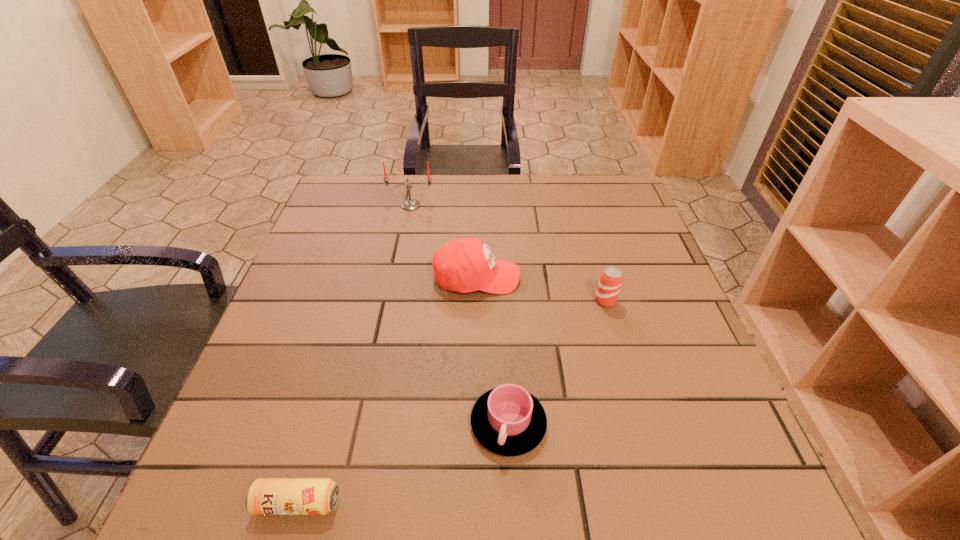
Where is `free space between the baseball cap and the third shortest object`? The width and height of the screenshot is (960, 540). free space between the baseball cap and the third shortest object is located at coordinates (541, 289).

What are the coordinates of `blank region between the baseball cap and the left beer can` in the screenshot? It's located at (387, 390).

Locate an element on the screen. free space between the second shortest object and the candle is located at coordinates (460, 314).

In order to click on empty space that is in between the fourth farthest object and the shorter beer can in this screenshot , I will do `click(403, 463)`.

Choose which object is the third nearest neighbor to the baseball cap. Please provide its 2D coordinates. Your answer should be formatted as a tuple, i.e. [(x, y)], where the tuple contains the x and y coordinates of a point satisfying the conditions above.

[(508, 420)]

Identify which object is located as the third nearest to the farthest object. Please provide its 2D coordinates. Your answer should be formatted as a tuple, i.e. [(x, y)], where the tuple contains the x and y coordinates of a point satisfying the conditions above.

[(508, 420)]

What are the coordinates of `vacant space that satisfies the following two spatial constraints: 1. on the front panel of the baseball cap; 2. on the back side of the right beer can` in the screenshot? It's located at (476, 301).

Where is `vacant region that satisfies the following two spatial constraints: 1. on the back side of the rightmost object; 2. on the front panel of the baseball cap`? vacant region that satisfies the following two spatial constraints: 1. on the back side of the rightmost object; 2. on the front panel of the baseball cap is located at coordinates (599, 278).

At what (x,y) coordinates should I click in order to perform the action: click on free space in the image that satisfies the following two spatial constraints: 1. on the front-facing side of the third shortest object; 2. on the right side of the farthest object. Please return your answer as a coordinate pair (x, y). Looking at the image, I should click on (392, 301).

Find the location of a particular element. free space that satisfies the following two spatial constraints: 1. on the front panel of the baseball cap; 2. on the front side of the left beer can is located at coordinates (474, 503).